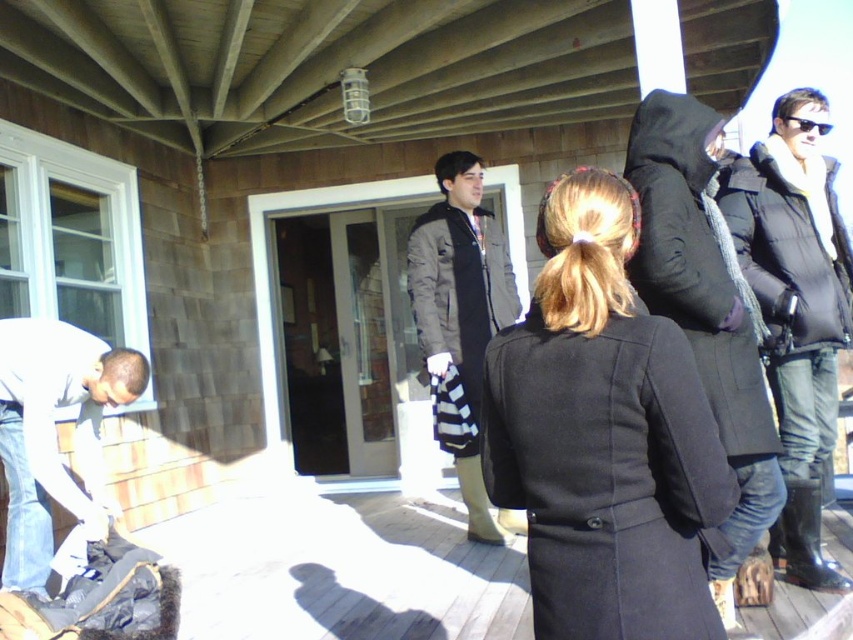
You are standing on the porch and need to reach the black wool coat at center to pick it up. Based on your current position, which direction should you move to get to the coat?

The black wool coat at center is located at point 0.680 on the x axis and 0.708 on the y axis. Since you are standing on the porch, you should move towards the center of the porch to reach the coat.

You are organizing a coat rack for a winter event and need to place the black wool coat at center and the dark gray fabric coat at center. Since the rack has limited vertical space, which coat should you place higher up to ensure both coats hang properly?

The black wool coat at center is shorter than the dark gray fabric coat at center, so you should place the shorter black wool coat at center higher up on the rack to accommodate the longer dark gray fabric coat at center below it.

You are organizing a coat rack for an event and need to know which item is narrower to place it in a tighter space. Based on the scene, which object is narrower between the black wool coat at center and the white cotton shirt at lower left?

The black wool coat at center is narrower than the white cotton shirt at lower left, so it can be placed in the tighter space.